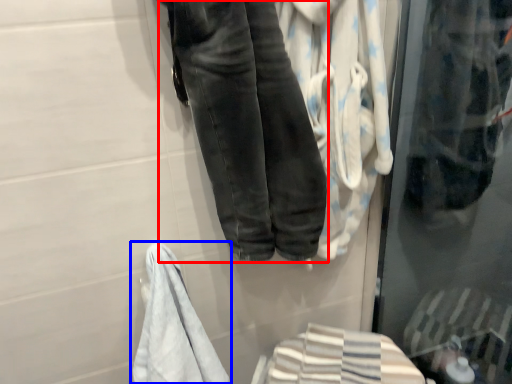
Question: Which of the following is the farthest to the observer, trousers (highlighted by a red box) or towel (highlighted by a blue box)?

Choices:
 (A) trousers
 (B) towel

Answer: (B)